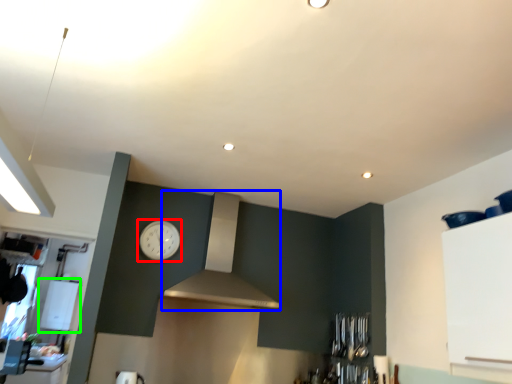
Question: Which object is positioned farthest from clock (highlighted by a red box)? Select from vent (highlighted by a blue box) and appliance (highlighted by a green box).

Choices:
 (A) vent
 (B) appliance

Answer: (B)